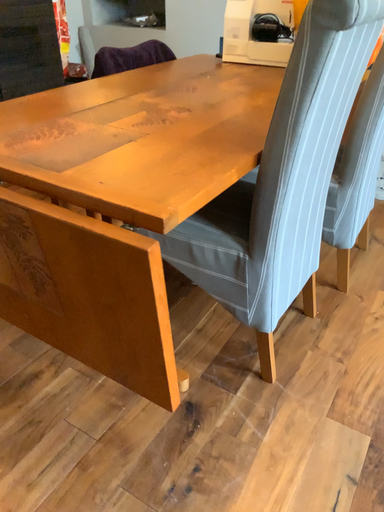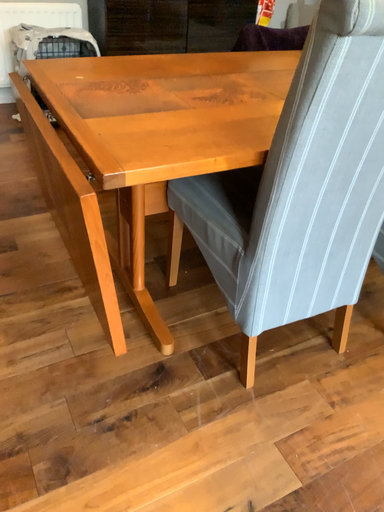
Question: Which way did the camera rotate in the video?

Choices:
 (A) rotated right
 (B) rotated left

Answer: (B)